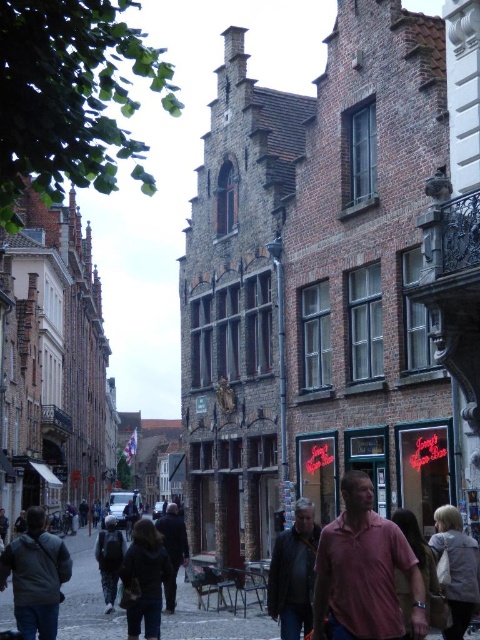
Question: Does light brown leather jacket at center come in front of dark brown leather jacket at center?

Choices:
 (A) yes
 (B) no

Answer: (A)

Question: Can you confirm if light brown leather jacket at center is smaller than dark blue jeans at center?

Choices:
 (A) yes
 (B) no

Answer: (A)

Question: Estimate the real-world distances between objects in this image. Which object is farther from the dark brown leather jacket at center?

Choices:
 (A) leather jacket at center
 (B) dark gray jacket at lower left
 (C) matte pink shirt at center
 (D) light brown leather jacket at center

Answer: (C)

Question: Can you confirm if leather jacket at center is wider than dark blue jacket at center?

Choices:
 (A) no
 (B) yes

Answer: (A)

Question: Which point is closer to the camera?

Choices:
 (A) dark blue jacket at center
 (B) dark gray jacket at lower left
 (C) dark blue jeans at center
 (D) light brown leather jacket at center

Answer: (B)

Question: Which point is closer to the camera?

Choices:
 (A) leather jacket at center
 (B) dark blue jeans at center
 (C) light brown leather jacket at center
 (D) dark gray jacket at lower left

Answer: (D)